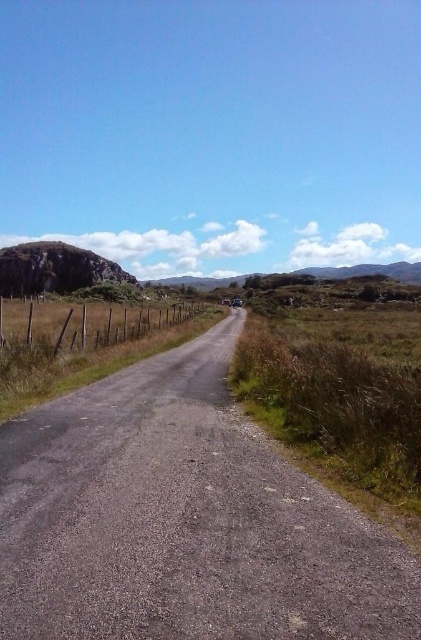
Which of these two, gray asphalt road at center or brown wooden fence at left, stands taller?

brown wooden fence at left

Locate an element on the screen. This screenshot has width=421, height=640. gray asphalt road at center is located at coordinates (183, 520).